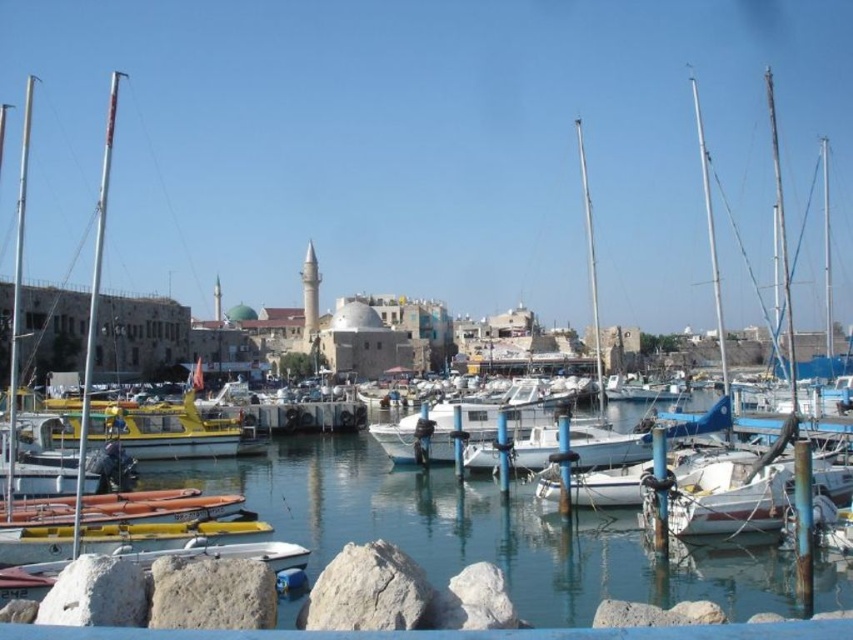
You are a small toy boat that is 10 cm wide. You want to sail from the rough textured rock at lower center to the clear blue water at center. Can you fit through the space between them?

The clear blue water at center might be wider than rough textured rock at lower center, so there is a possibility that the space between them is wide enough for the 10 cm wide toy boat to pass through. However, since the exact width isn not specified, it depends on the actual gap available.

You are a tour guide explaining the marina layout to visitors. You mention the clear blue water at center and the rough textured rock at lower center. How far apart are these two features?

The distance between the clear blue water at center and the rough textured rock at lower center is 17.44 meters.